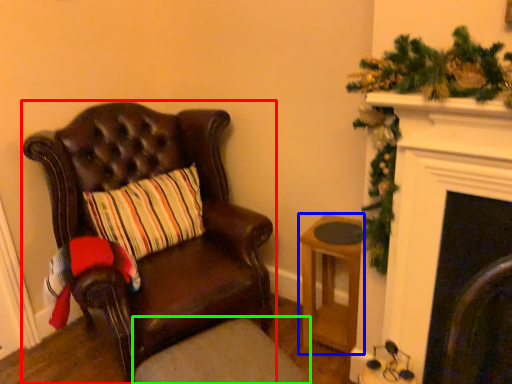
Question: Estimate the real-world distances between objects in this image. Which object is farther from chair (highlighted by a red box), stool (highlighted by a blue box) or footrest (highlighted by a green box)?

Choices:
 (A) stool
 (B) footrest

Answer: (A)